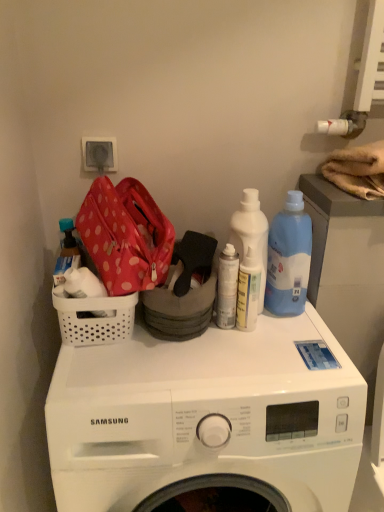
Where is `free space to the right of translucent plastic spray bottle at center, which is counted as the 1th cleaning product, starting from the left`? This screenshot has width=384, height=512. free space to the right of translucent plastic spray bottle at center, which is counted as the 1th cleaning product, starting from the left is located at coordinates (297, 333).